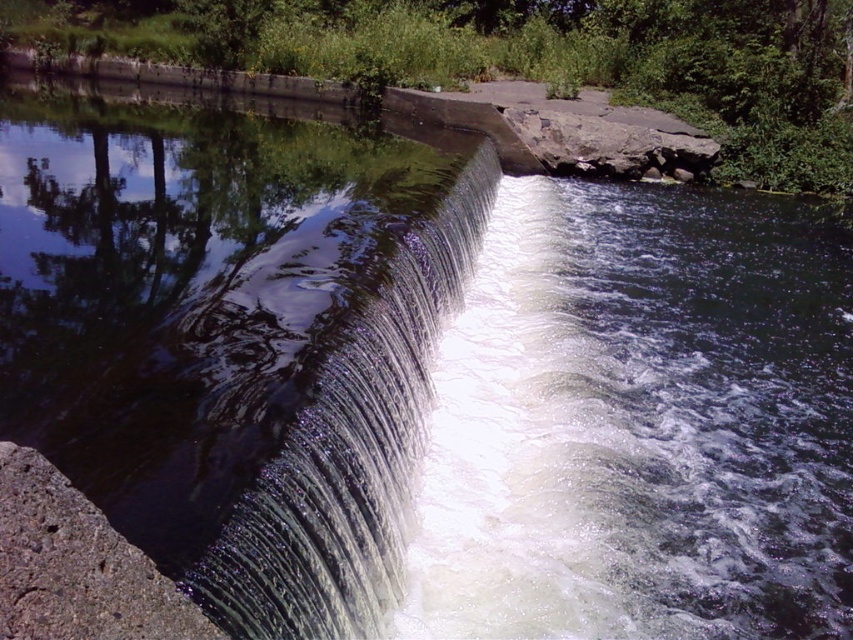
You are a landscape architect designing a new park. You need to place a bench so that visitors can see both the clear glass waterfall at center and the gray rough concrete at lower left. Where should the bench be positioned relative to these two features?

The bench should be positioned in a location where both the clear glass waterfall at center and the gray rough concrete at lower left are visible. Since the clear glass waterfall at center might be wider than the gray rough concrete at lower left, placing the bench at a central point between them or slightly closer to the narrower gray rough concrete at lower left would ensure both features are within view.

You are standing at the base of the waterfall and want to know how far you are from the point marked at coordinates point (566, 40). Can you determine the distance?

The distance between you and point (566, 40) is 38.41 meters.